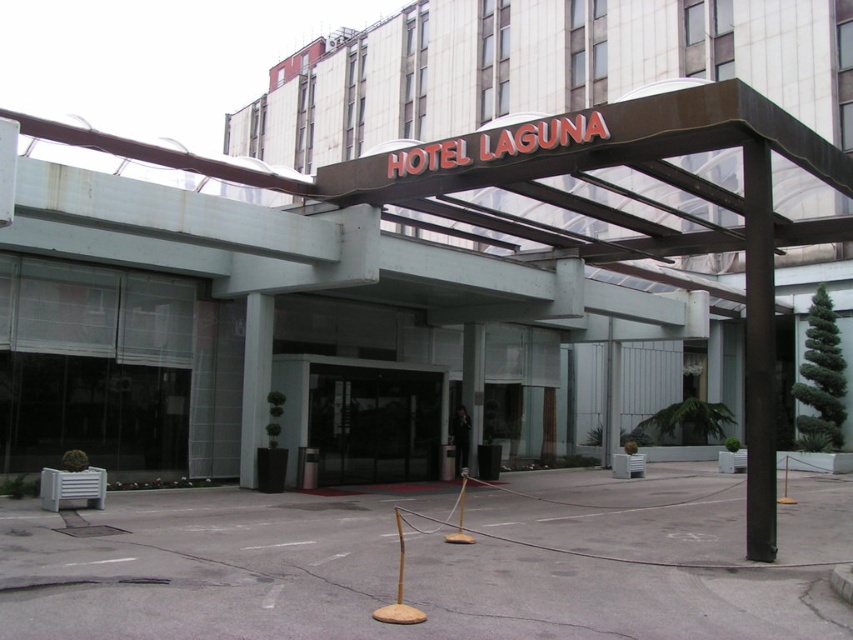
You are a delivery person trying to enter Hotel Laguna. You see the metallic signboard at center and the transparent glass door at center. Which object is taller?

The metallic signboard at center is taller than the transparent glass door at center.

You are standing at the entrance of Hotel Laguna and want to enter through the transparent glass door at center. There is a white glossy pillar at center blocking your path. Can you walk around the pillar to reach the door?

The transparent glass door at center is further to the viewer than the white glossy pillar at center, so the pillar is closer to you. You can walk around the pillar to reach the door since it is in front of the door.

You are a delivery person with a large box that is 1.2 meters wide. You need to enter Hotel Laguna through the entrance shown. Can you fit through the transparent glass door at center without tilting the box? Please consider the width of the white glossy pillar at center as a reference.

The transparent glass door at center might be wider than the white glossy pillar at center. Since the pillar is a reference, if the door is indeed wider, the 1.2 meter box could fit. However, without exact measurements, there is uncertainty. Proceed with caution.